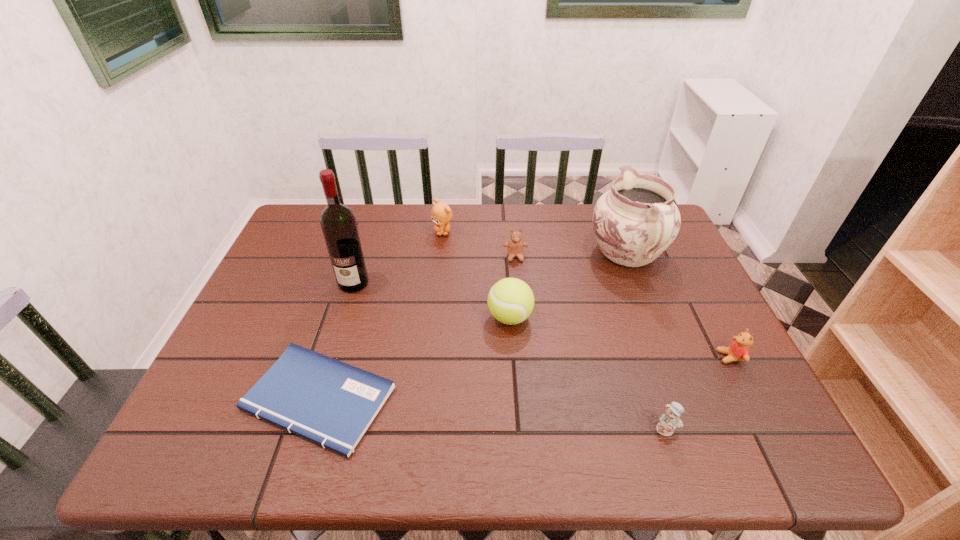
Where is `alcohol`? The width and height of the screenshot is (960, 540). alcohol is located at coordinates (338, 222).

Where is `pitcher`? pitcher is located at coordinates coord(637,220).

Find the location of a particular element. The image size is (960, 540). tennis ball is located at coordinates (511, 301).

You are a GUI agent. You are given a task and a screenshot of the screen. Output one action in this format:
    pyautogui.click(x=<x>, y=<y>)
    Task: Click on the farthest teddy bear
    The width and height of the screenshot is (960, 540).
    Given the screenshot: What is the action you would take?
    pyautogui.click(x=441, y=214)

Identify the location of the sixth object from right to left. 441,214.

This screenshot has width=960, height=540. Identify the location of the second farthest teddy bear. (515, 246).

I want to click on the second nearest teddy bear, so click(738, 350).

The width and height of the screenshot is (960, 540). In order to click on the third teddy bear from left to right in this screenshot , I will do `click(669, 421)`.

Locate an element on the screen. The width and height of the screenshot is (960, 540). the shortest object is located at coordinates (331, 403).

Identify the location of free space located 0.270m on the front and back of the tallest object. The height and width of the screenshot is (540, 960). point(324,376).